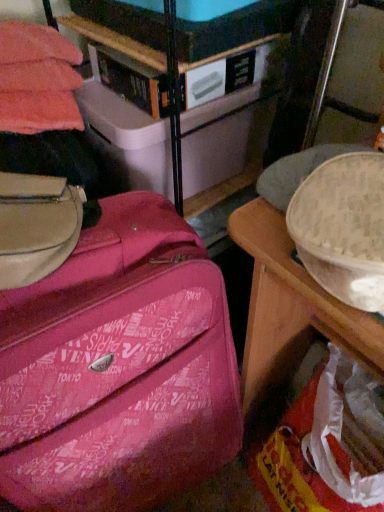
Question: Can you confirm if matte white storage box at upper center is wider than pink fabric suitcase at center?

Choices:
 (A) yes
 (B) no

Answer: (B)

Question: Is matte white storage box at upper center smaller than pink fabric suitcase at center?

Choices:
 (A) yes
 (B) no

Answer: (A)

Question: Can you confirm if matte white storage box at upper center is shorter than pink fabric suitcase at center?

Choices:
 (A) yes
 (B) no

Answer: (A)

Question: Can you confirm if matte white storage box at upper center is positioned to the left of pink fabric suitcase at center?

Choices:
 (A) yes
 (B) no

Answer: (B)

Question: Does matte white storage box at upper center have a lesser width compared to pink fabric suitcase at center?

Choices:
 (A) yes
 (B) no

Answer: (A)

Question: From the image's perspective, does matte white storage box at upper center appear lower than pink fabric suitcase at center?

Choices:
 (A) no
 (B) yes

Answer: (A)

Question: Is pink fabric suitcase at center behind matte white storage box at upper center?

Choices:
 (A) yes
 (B) no

Answer: (B)

Question: Considering the relative positions of pink fabric suitcase at center and matte white storage box at upper center in the image provided, is pink fabric suitcase at center to the right of matte white storage box at upper center from the viewer's perspective?

Choices:
 (A) yes
 (B) no

Answer: (B)

Question: Can you confirm if pink fabric suitcase at center is wider than matte white storage box at upper center?

Choices:
 (A) no
 (B) yes

Answer: (B)

Question: Can you see pink fabric suitcase at center touching matte white storage box at upper center?

Choices:
 (A) no
 (B) yes

Answer: (A)

Question: Considering the relative positions of pink fabric suitcase at center and matte white storage box at upper center in the image provided, is pink fabric suitcase at center to the left of matte white storage box at upper center from the viewer's perspective?

Choices:
 (A) no
 (B) yes

Answer: (B)

Question: From the image's perspective, is pink fabric suitcase at center below matte white storage box at upper center?

Choices:
 (A) yes
 (B) no

Answer: (A)

Question: Looking at the image, does pink fabric suitcase at center seem bigger or smaller compared to matte white storage box at upper center?

Choices:
 (A) big
 (B) small

Answer: (A)